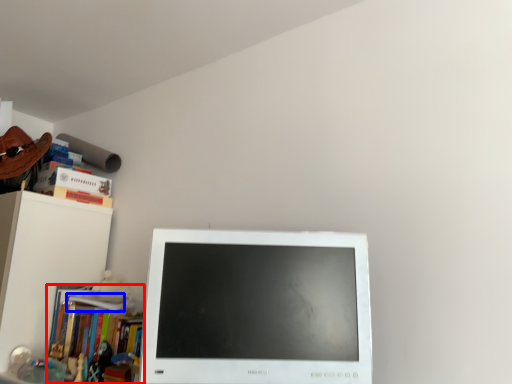
Question: Which point is further to the camera, book (highlighted by a red box) or book (highlighted by a blue box)?

Choices:
 (A) book
 (B) book

Answer: (B)